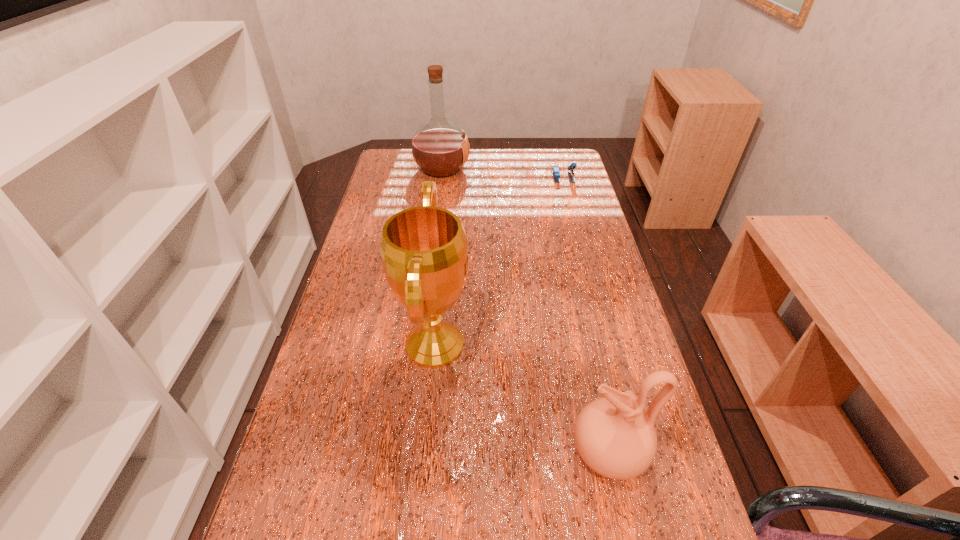
What are the coordinates of `vacant space at the right edge of the desktop` in the screenshot? It's located at (634, 361).

Where is `free point between the pottery and the second nearest object`? free point between the pottery and the second nearest object is located at coordinates (521, 399).

Where is `free space between the liquor and the nearest object`? The width and height of the screenshot is (960, 540). free space between the liquor and the nearest object is located at coordinates (525, 310).

You are a GUI agent. You are given a task and a screenshot of the screen. Output one action in this format:
    pyautogui.click(x=<x>, y=<y>)
    Task: Click on the free spot between the award and the stapler
    The image size is (960, 540).
    Given the screenshot: What is the action you would take?
    pyautogui.click(x=499, y=261)

Find the location of `empty space between the liquor and the nearest object`. empty space between the liquor and the nearest object is located at coordinates (525, 310).

What are the coordinates of `vacant space that is in between the liquor and the stapler` in the screenshot? It's located at (503, 173).

Identify the location of the closest object to the liquor. point(556,174).

This screenshot has width=960, height=540. What are the coordinates of `the closest object relative to the shortest object` in the screenshot? It's located at (440, 148).

You are a GUI agent. You are given a task and a screenshot of the screen. Output one action in this format:
    pyautogui.click(x=<x>, y=<y>)
    Task: Click on the vacant position in the image that satisfies the following two spatial constraints: 1. on the front label of the stapler; 2. on the right side of the liquor
    
    Given the screenshot: What is the action you would take?
    pyautogui.click(x=441, y=177)

Identify the location of vacant space that satisfies the following two spatial constraints: 1. on the front label of the liquor; 2. on the back side of the stapler. (441, 177).